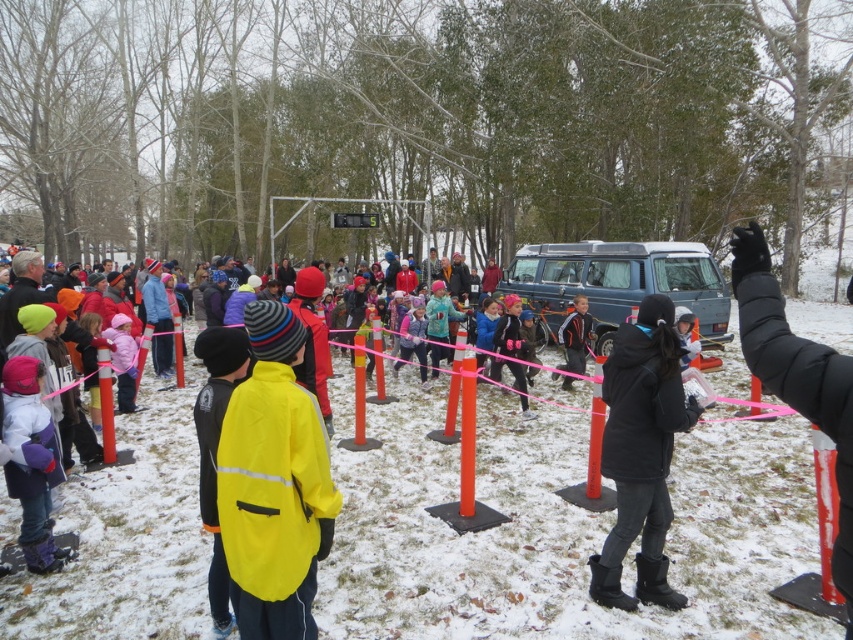
Looking at this image, how distant is black puffy glove at upper right from dark blue jacket at center?

black puffy glove at upper right and dark blue jacket at center are 23.50 feet apart.

What do you see at coordinates (798, 380) in the screenshot? The image size is (853, 640). I see `black puffy glove at upper right` at bounding box center [798, 380].

Where is `black puffy glove at upper right`? This screenshot has height=640, width=853. black puffy glove at upper right is located at coordinates coord(798,380).

Does black matte jacket at lower right appear under purple fleece jacket at lower left?

Actually, black matte jacket at lower right is above purple fleece jacket at lower left.

Can you confirm if black matte jacket at lower right is bigger than purple fleece jacket at lower left?

Yes, black matte jacket at lower right is bigger than purple fleece jacket at lower left.

Who is more forward, [633,465] or [33,419]?

Point [633,465] is in front.

This screenshot has height=640, width=853. I want to click on black matte jacket at lower right, so click(x=641, y=452).

Locate an element on the screen. The image size is (853, 640). black puffy glove at upper right is located at coordinates (798, 380).

What do you see at coordinates (798, 380) in the screenshot?
I see `black puffy glove at upper right` at bounding box center [798, 380].

The width and height of the screenshot is (853, 640). I want to click on black puffy glove at upper right, so click(798, 380).

I want to click on black puffy glove at upper right, so click(x=798, y=380).